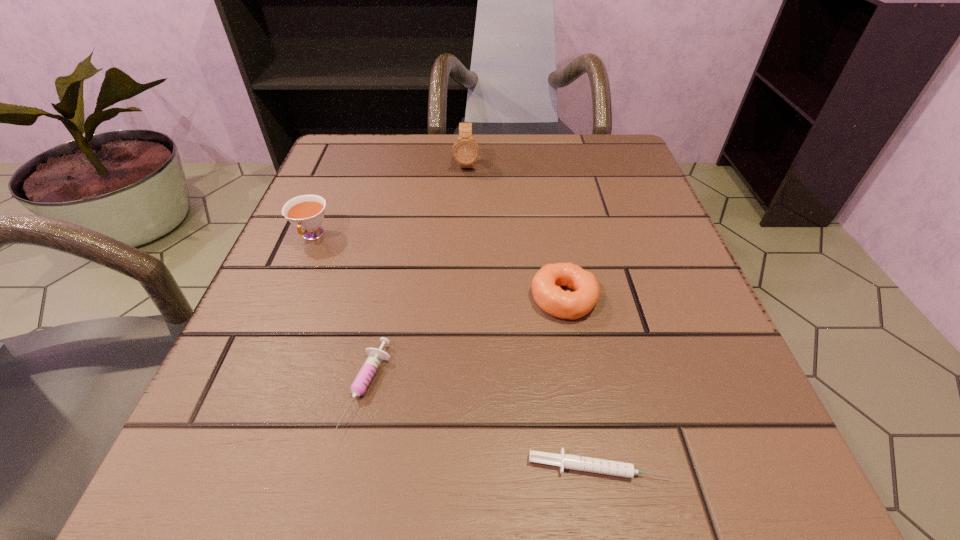
Identify the location of free space located 0.110m on the face of the farthest object. The image size is (960, 540). click(x=465, y=205).

Find the location of `vacant space situated 0.180m on the side of the teacup with the handle`. vacant space situated 0.180m on the side of the teacup with the handle is located at coordinates (271, 336).

Image resolution: width=960 pixels, height=540 pixels. I want to click on free location located 0.250m on the front of the doughnut, so click(603, 512).

This screenshot has height=540, width=960. Find the location of `vacant position located on the back of the taller syringe`. vacant position located on the back of the taller syringe is located at coordinates (389, 282).

You are a GUI agent. You are given a task and a screenshot of the screen. Output one action in this format:
    pyautogui.click(x=<x>, y=<y>)
    Task: Click on the vacant point located 0.310m on the left of the nearest object
    This screenshot has width=960, height=540.
    Given the screenshot: What is the action you would take?
    pyautogui.click(x=251, y=466)

The height and width of the screenshot is (540, 960). I want to click on object situated at the far edge, so click(465, 151).

At what (x,y) coordinates should I click in order to perform the action: click on object present at the near edge. Please return your answer as a coordinate pair (x, y). The height and width of the screenshot is (540, 960). Looking at the image, I should click on (601, 466).

The image size is (960, 540). In order to click on object positioned at the left edge in this screenshot , I will do `click(306, 212)`.

At what (x,y) coordinates should I click in order to perform the action: click on doughnut that is positioned at the right edge. Please return your answer as a coordinate pair (x, y). The image size is (960, 540). Looking at the image, I should click on (546, 285).

The image size is (960, 540). Identify the location of syringe at the right edge. (601, 466).